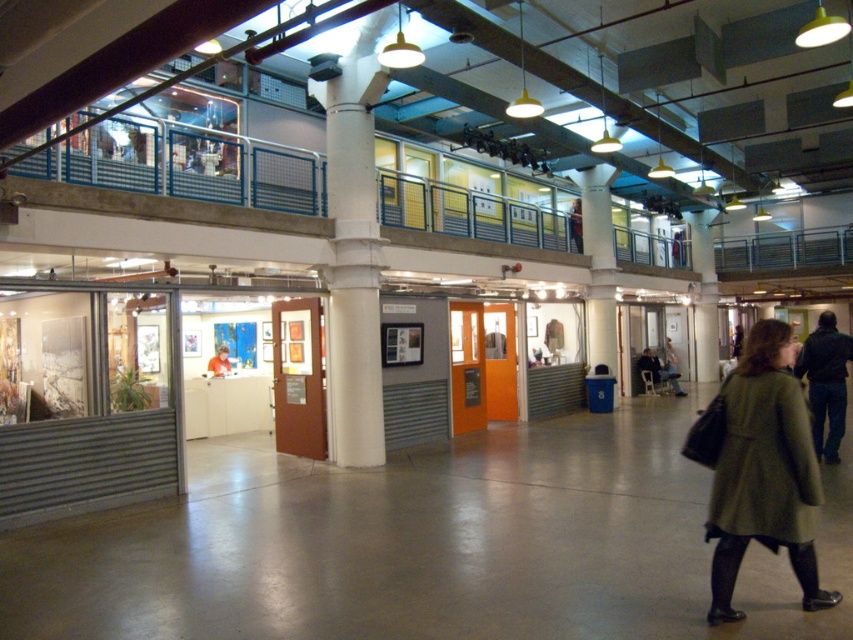
Is the position of white glossy column at center less distant than that of orange fabric shirt at center?

Yes, it is in front of orange fabric shirt at center.

Between white glossy column at center and orange fabric shirt at center, which one has less height?

orange fabric shirt at center

Who is more distant from viewer, (355,412) or (227,356)?

Positioned behind is point (227,356).

Where is `white glossy column at center`? The image size is (853, 640). white glossy column at center is located at coordinates (352, 264).

Is point (727, 497) positioned before point (228, 368)?

That is True.

Locate an element on the screen. The width and height of the screenshot is (853, 640). green woolen coat at lower right is located at coordinates (764, 461).

This screenshot has width=853, height=640. Identify the location of green woolen coat at lower right. (764, 461).

Is white concrete pillar at center taller than dark blue jacket at lower right?

Indeed, white concrete pillar at center has a greater height compared to dark blue jacket at lower right.

Who is positioned more to the right, white concrete pillar at center or dark blue jacket at lower right?

dark blue jacket at lower right

What do you see at coordinates (599, 266) in the screenshot?
I see `white concrete pillar at center` at bounding box center [599, 266].

This screenshot has height=640, width=853. Identify the location of white concrete pillar at center. (599, 266).